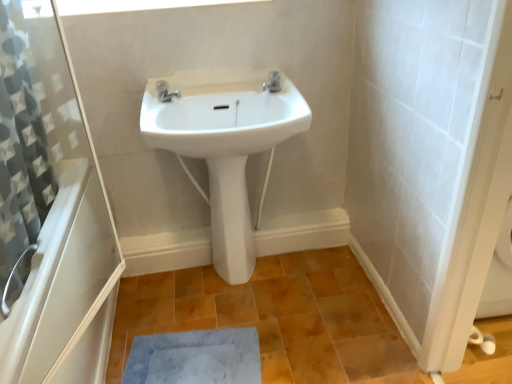
Question: Is there a large distance between orange matte tile at center and transparent plastic window screen at upper center?

Choices:
 (A) yes
 (B) no

Answer: (A)

Question: From a real-world perspective, is orange matte tile at center under transparent plastic window screen at upper center?

Choices:
 (A) yes
 (B) no

Answer: (A)

Question: Does orange matte tile at center come behind transparent plastic window screen at upper center?

Choices:
 (A) yes
 (B) no

Answer: (B)

Question: Is orange matte tile at center located outside transparent plastic window screen at upper center?

Choices:
 (A) yes
 (B) no

Answer: (A)

Question: From the image's perspective, is orange matte tile at center on transparent plastic window screen at upper center?

Choices:
 (A) no
 (B) yes

Answer: (A)

Question: Considering the relative sizes of orange matte tile at center and transparent plastic window screen at upper center in the image provided, is orange matte tile at center wider than transparent plastic window screen at upper center?

Choices:
 (A) yes
 (B) no

Answer: (A)

Question: Considering the relative sizes of polished chrome tap at upper center, the second tap positioned from the right, and gray textured shower curtain at left in the image provided, is polished chrome tap at upper center, the second tap positioned from the right, thinner than gray textured shower curtain at left?

Choices:
 (A) no
 (B) yes

Answer: (B)

Question: Can you confirm if polished chrome tap at upper center, the second tap positioned from the right, is taller than gray textured shower curtain at left?

Choices:
 (A) no
 (B) yes

Answer: (A)

Question: From the image's perspective, is polished chrome tap at upper center, the 1th tap in the left-to-right sequence, located beneath gray textured shower curtain at left?

Choices:
 (A) yes
 (B) no

Answer: (B)

Question: From the image's perspective, is polished chrome tap at upper center, the 1th tap in the left-to-right sequence, above gray textured shower curtain at left?

Choices:
 (A) no
 (B) yes

Answer: (B)

Question: Could you tell me if polished chrome tap at upper center, the 1th tap in the left-to-right sequence, is turned towards gray textured shower curtain at left?

Choices:
 (A) yes
 (B) no

Answer: (B)

Question: Is polished chrome tap at upper center, the 1th tap in the left-to-right sequence, at the right side of gray textured shower curtain at left?

Choices:
 (A) yes
 (B) no

Answer: (A)

Question: Considering the relative sizes of white ceramic sink at center and white glossy bidet at center in the image provided, is white ceramic sink at center smaller than white glossy bidet at center?

Choices:
 (A) yes
 (B) no

Answer: (B)